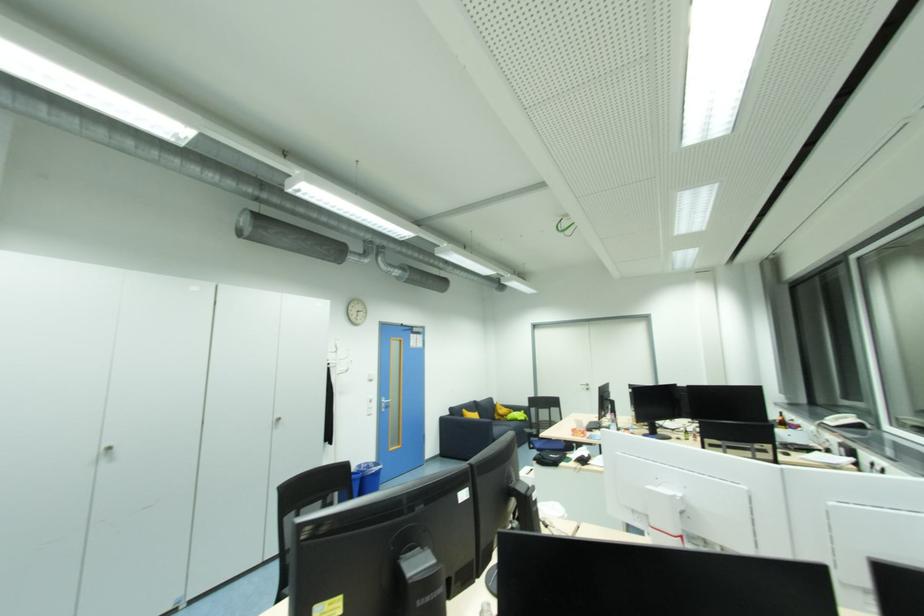
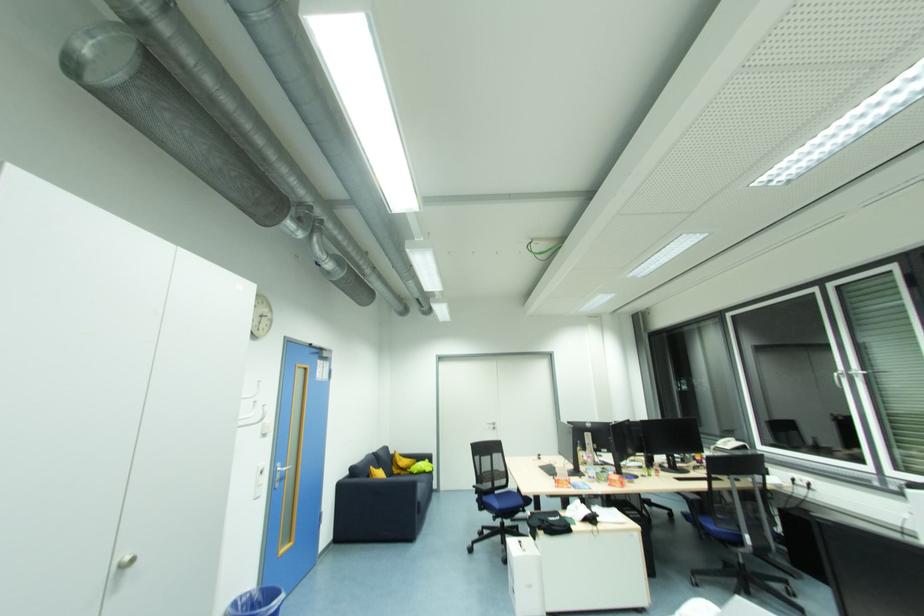
Where in the second image is the point corresponding to point (445, 421) from the first image?

(343, 487)